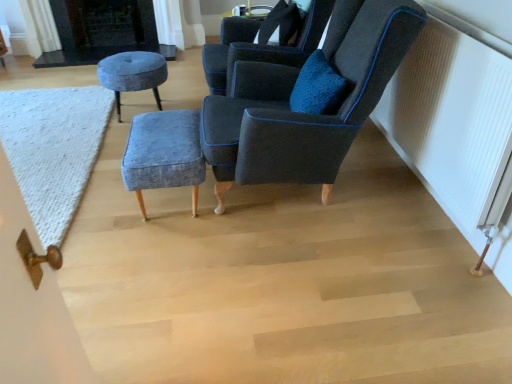
Locate an element on the screen. This screenshot has height=384, width=512. free space underneath denim fabric stool at center, which ranks as the 1th stool in front-to-back order (from a real-world perspective) is located at coordinates (168, 204).